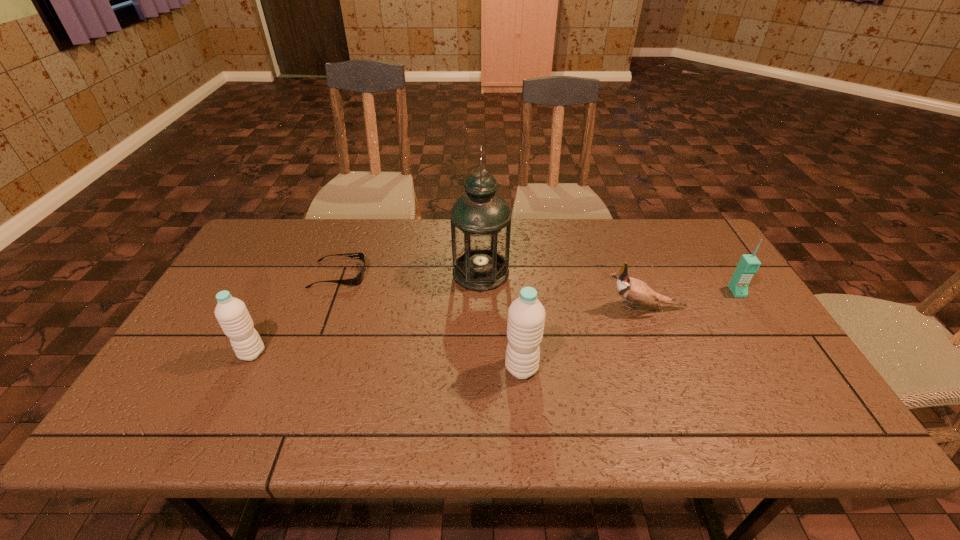
Locate an element on the screen. The height and width of the screenshot is (540, 960). free space located on the back of the shorter water bottle is located at coordinates (275, 307).

Locate an element on the screen. free space located on the left of the second tallest object is located at coordinates (421, 368).

Where is `free space located 0.240m on the front-facing side of the sunglasses`? free space located 0.240m on the front-facing side of the sunglasses is located at coordinates (446, 275).

Where is `vacant space located 0.240m on the keypad of the cellular telephone`? This screenshot has height=540, width=960. vacant space located 0.240m on the keypad of the cellular telephone is located at coordinates (784, 367).

Locate an element on the screen. This screenshot has width=960, height=540. vacant region located 0.170m at the face of the third nearest object is located at coordinates tap(540, 308).

Locate an element on the screen. free space located 0.290m at the face of the third nearest object is located at coordinates (496, 308).

You are a GUI agent. You are given a task and a screenshot of the screen. Output one action in this format:
    pyautogui.click(x=<x>, y=<y>)
    Task: Click on the vacant area situated 0.220m at the face of the third nearest object
    The height and width of the screenshot is (540, 960).
    Given the screenshot: What is the action you would take?
    (x=521, y=308)

Find the location of a particular element. Image resolution: width=960 pixels, height=540 pixels. free location located 0.200m on the left of the tallest object is located at coordinates (386, 273).

Find the location of `sunglasses that is at the far edge`. sunglasses that is at the far edge is located at coordinates (357, 280).

At what (x,y) coordinates should I click in order to perform the action: click on oil lamp located in the far edge section of the desktop. Please return your answer as a coordinate pair (x, y). Looking at the image, I should click on (480, 220).